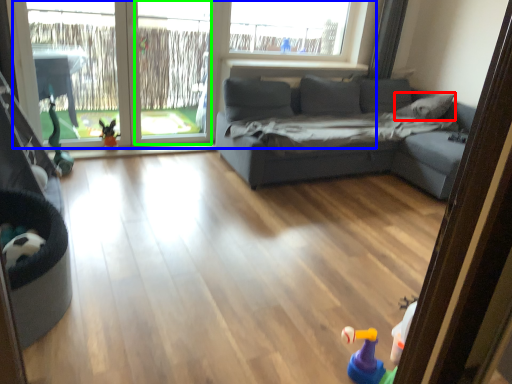
Question: Based on their relative distances, which object is farther from pillow (highlighted by a red box)? Choose from window (highlighted by a blue box) and window screen (highlighted by a green box).

Choices:
 (A) window
 (B) window screen

Answer: (B)